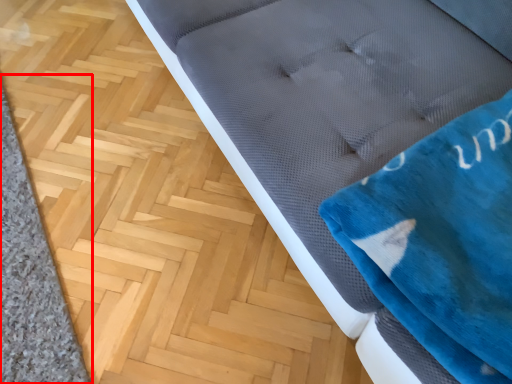
Question: From the image's perspective, what is the correct spatial relationship of doormat (annotated by the red box) in relation to cloth?

Choices:
 (A) below
 (B) above

Answer: (A)